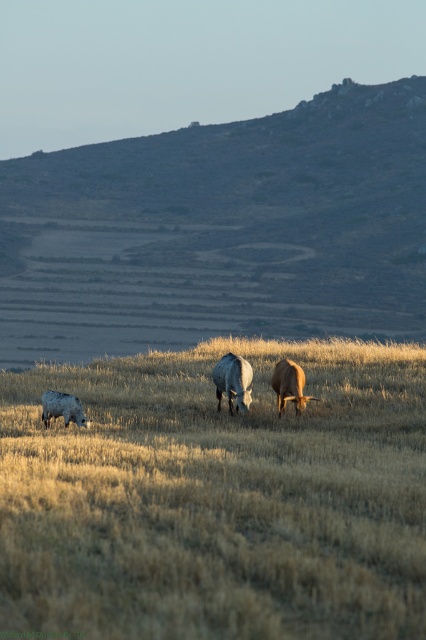
Question: Which point is closer to the camera?

Choices:
 (A) dull gray stone hillside at upper center
 (B) dry grass at center

Answer: (B)

Question: Is dry grass at center to the right of brown matte cow at center from the viewer's perspective?

Choices:
 (A) no
 (B) yes

Answer: (A)

Question: Is dry grass at center to the left of dull gray stone hillside at upper center from the viewer's perspective?

Choices:
 (A) yes
 (B) no

Answer: (B)

Question: Can you confirm if dull gray stone hillside at upper center is thinner than brown matte cow at center?

Choices:
 (A) no
 (B) yes

Answer: (A)

Question: Which object appears closest to the camera in this image?

Choices:
 (A) shiny brown cow at center
 (B) dry grass at center
 (C) dull gray stone hillside at upper center

Answer: (B)

Question: Among these points, which one is nearest to the camera?

Choices:
 (A) (267, 333)
 (B) (284, 381)
 (C) (239, 385)
 (D) (206, 387)

Answer: (C)